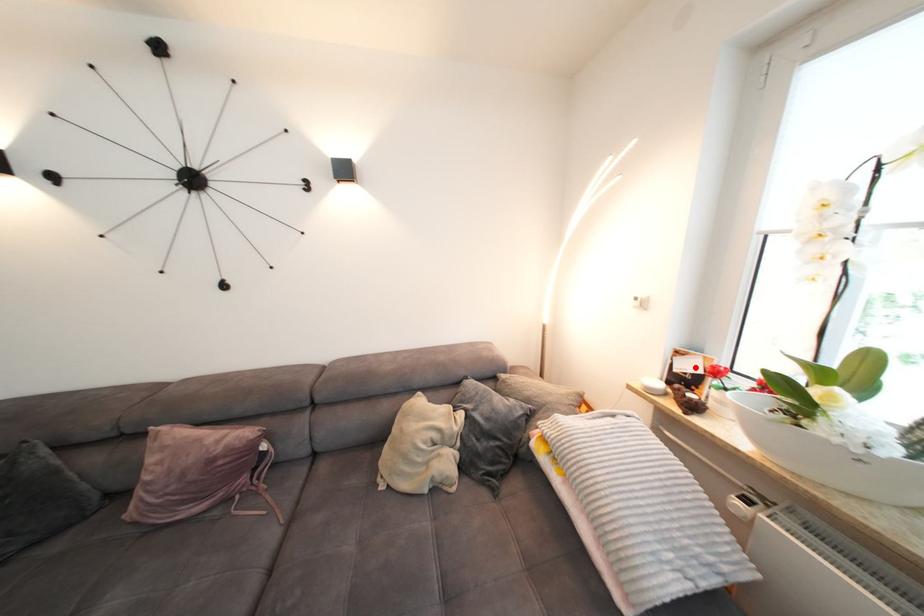
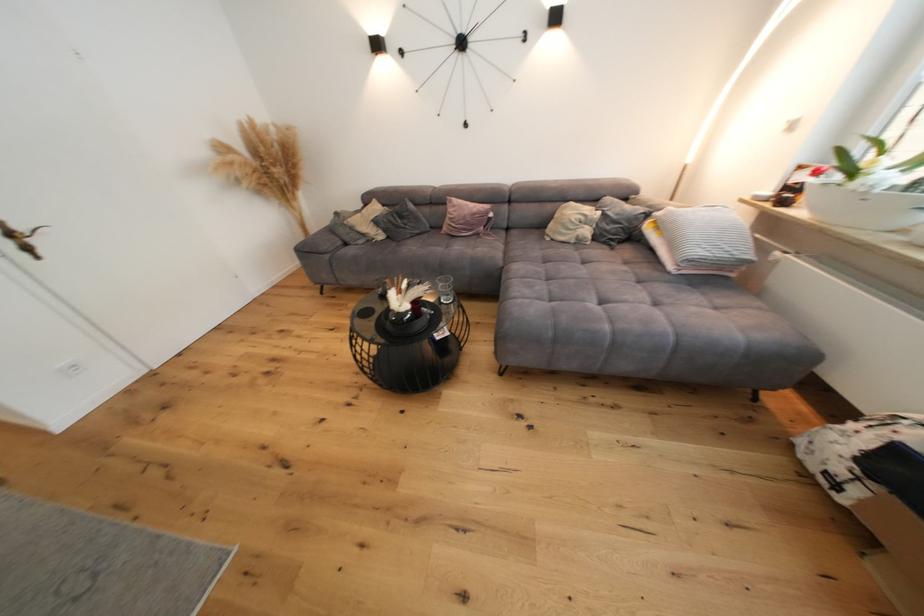
Question: A red point is marked in image1. In image2, is the corresponding 3D point closer to the camera or farther? Reply with the corresponding letter.

Choices:
 (A) The corresponding 3D point is closer.
 (B) The corresponding 3D point is farther.

Answer: (B)